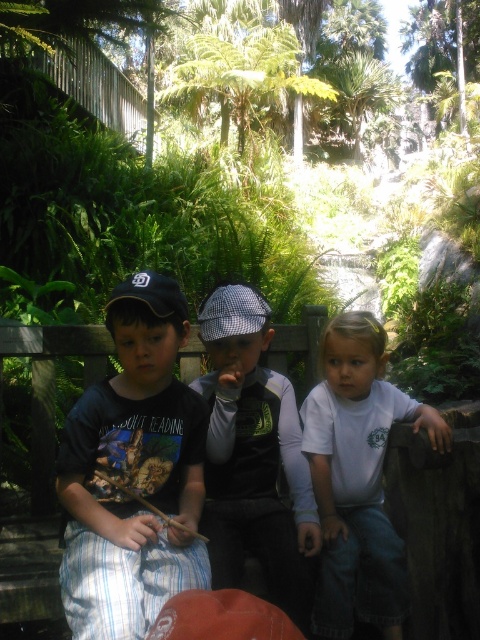
You are a photographer trying to capture a group shot of the children. You need to ensure that the dark blue cotton shirt at left and the checkered fabric cap at center are both visible in the frame. Based on their sizes, which object should you focus on to ensure both are in focus?

The dark blue cotton shirt at left is wider than the checkered fabric cap at center. Therefore, focusing on the wider object, the dark blue cotton shirt at left, will help ensure both are in focus since it covers more area.

You are a photographer trying to capture a photo of the dark blue cotton shirt at left and the orange fabric baseball hat at lower center. Which object is positioned higher in the frame?

The dark blue cotton shirt at left is positioned higher in the frame than the orange fabric baseball hat at lower center.

You are standing at the point marked as point (271, 483) in the image. A butterfly is flying towards you from the direction of the wooden bench where the children are sitting. If the butterfly is currently 1.5 meters away from you, will it reach you before it gets tired after flying 1.8 meters?

The butterfly is currently 1.5 meters away from the point (271, 483). Since the butterfly can fly 1.8 meters before getting tired, which is more than the 1.5 meters distance to you, it will reach you before getting tired.